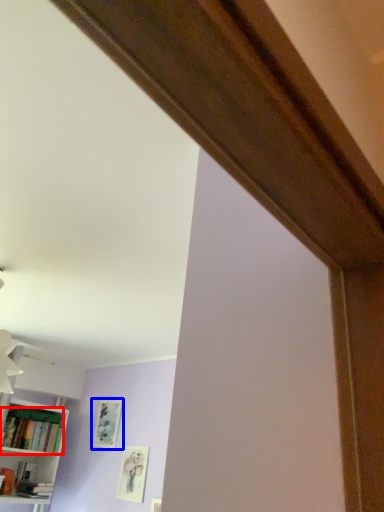
Question: Which object appears farthest to the camera in this image, book (highlighted by a red box) or picture frame (highlighted by a blue box)?

Choices:
 (A) book
 (B) picture frame

Answer: (B)